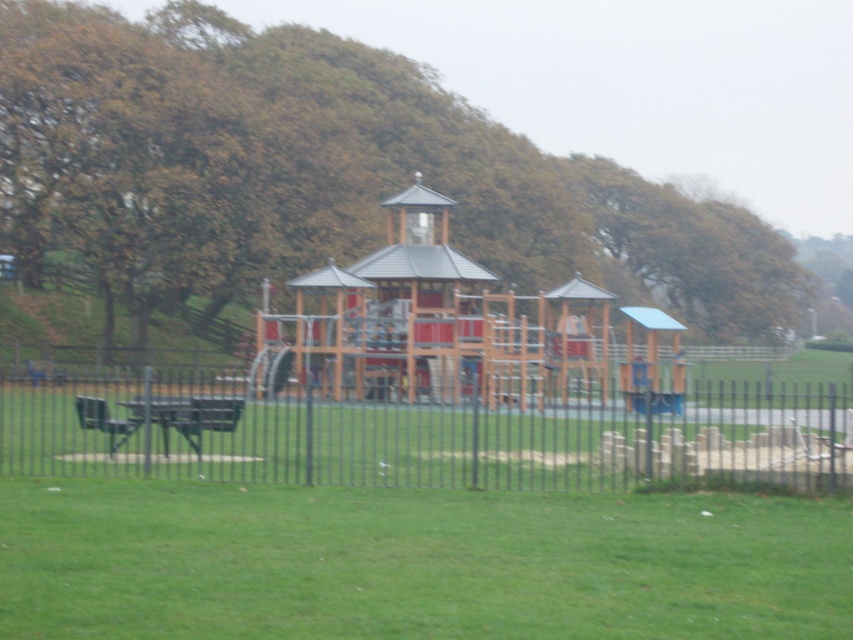
You are a parent trying to find a spot to place your child on the green grass at lower center. However, there is a brown wood tree at center in the way. Can you move around the tree to reach the grass?

The green grass at lower center is behind the brown wood tree at center, so you can move around the tree to reach the grass.

You are planning to install a new play structure in the playground. The play structure requires a space that is larger than the wooden gazebo at center. Can the area enclosed by the black metal fence at center accommodate the new play structure?

The black metal fence at center has a larger size compared to wooden gazebo at center, so the area enclosed by the black metal fence at center can accommodate the new play structure since it is larger than the wooden gazebo at center.